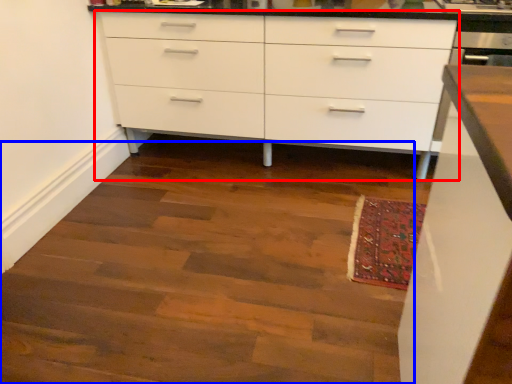
Question: Which point is closer to the camera, chest of drawers (highlighted by a red box) or stairwell (highlighted by a blue box)?

Choices:
 (A) chest of drawers
 (B) stairwell

Answer: (B)